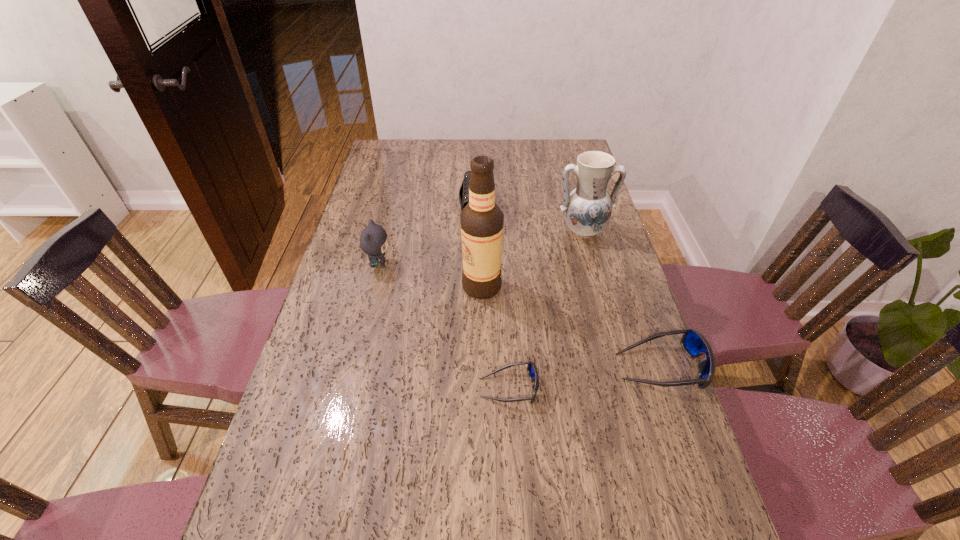
At what (x,y) coordinates should I click in order to perform the action: click on the shorter sunglasses. Please return your answer as a coordinate pair (x, y). Image resolution: width=960 pixels, height=540 pixels. Looking at the image, I should click on (532, 371).

I want to click on the shortest object, so click(x=532, y=371).

The height and width of the screenshot is (540, 960). Identify the location of the taller sunglasses. (693, 342).

Identify the location of the fifth tallest object. This screenshot has height=540, width=960. (693, 342).

Where is `the fifth shortest object`? Image resolution: width=960 pixels, height=540 pixels. the fifth shortest object is located at coordinates (587, 209).

Where is `alcohol`? The width and height of the screenshot is (960, 540). alcohol is located at coordinates (481, 220).

What are the coordinates of `kitten` in the screenshot? It's located at (373, 240).

This screenshot has height=540, width=960. What are the coordinates of `the fourth shortest object` in the screenshot? It's located at (373, 240).

Where is `the fourth tallest object`? The width and height of the screenshot is (960, 540). the fourth tallest object is located at coordinates (464, 189).

Image resolution: width=960 pixels, height=540 pixels. Find the location of `vacant region located on the front-facing side of the left sunglasses`. vacant region located on the front-facing side of the left sunglasses is located at coordinates (637, 388).